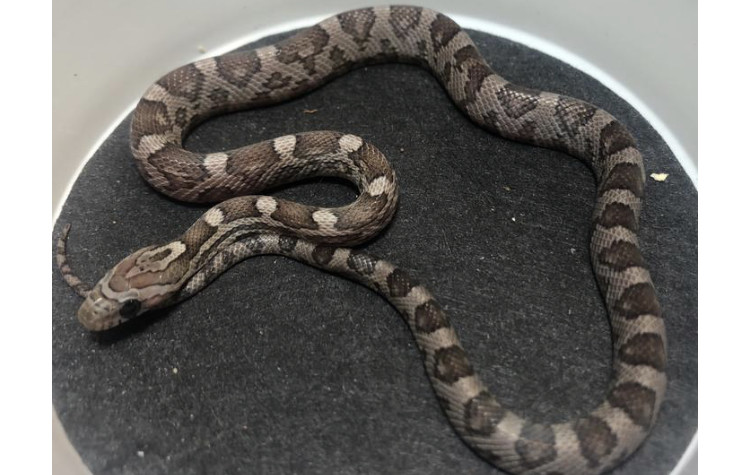
The height and width of the screenshot is (475, 750). I want to click on grey surface in the top right corner, so click(x=645, y=37).